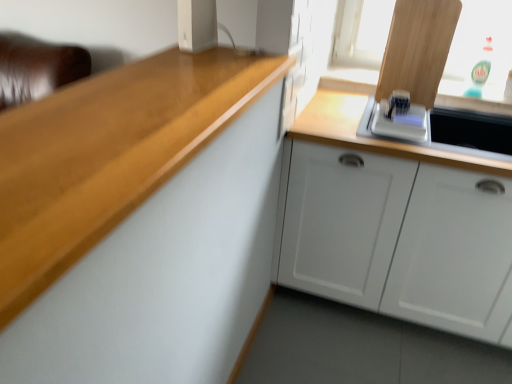
Question: Is white plastic speaker at upper center, positioned as the 2th appliance in back-to-front order, surrounded by white plastic toaster at upper right, arranged as the first appliance when viewed from the back?

Choices:
 (A) no
 (B) yes

Answer: (A)

Question: Is white plastic toaster at upper right, the 1th appliance when ordered from right to left, bigger than white plastic speaker at upper center, which is the 1th appliance from left to right?

Choices:
 (A) yes
 (B) no

Answer: (A)

Question: Is white plastic toaster at upper right, arranged as the first appliance when viewed from the back, to the right of white plastic speaker at upper center, which is the 1th appliance from left to right, from the viewer's perspective?

Choices:
 (A) yes
 (B) no

Answer: (A)

Question: Are white plastic toaster at upper right, arranged as the first appliance when viewed from the back, and white plastic speaker at upper center, positioned as the 2th appliance in back-to-front order, far apart?

Choices:
 (A) no
 (B) yes

Answer: (A)

Question: From a real-world perspective, is white plastic toaster at upper right, arranged as the first appliance when viewed from the back, located beneath white plastic speaker at upper center, which is the 1th appliance from left to right?

Choices:
 (A) no
 (B) yes

Answer: (B)

Question: From the image's perspective, is white plastic toaster at upper right, placed as the second appliance when sorted from front to back, located beneath white plastic speaker at upper center, which is the 1th appliance from left to right?

Choices:
 (A) yes
 (B) no

Answer: (A)

Question: Is white plastic speaker at upper center, positioned as the 2th appliance in back-to-front order, oriented away from white glossy microwave at upper right?

Choices:
 (A) yes
 (B) no

Answer: (B)

Question: Does white plastic speaker at upper center, which is the 1th appliance from left to right, appear on the right side of white glossy microwave at upper right?

Choices:
 (A) no
 (B) yes

Answer: (A)

Question: From a real-world perspective, is white plastic speaker at upper center, which is the 1th appliance from left to right, positioned under white glossy microwave at upper right based on gravity?

Choices:
 (A) no
 (B) yes

Answer: (A)

Question: Is white plastic speaker at upper center, the second appliance viewed from the right, closer to camera compared to white glossy microwave at upper right?

Choices:
 (A) yes
 (B) no

Answer: (A)

Question: Considering the relative sizes of white plastic speaker at upper center, the first appliance viewed from the front, and white glossy microwave at upper right in the image provided, is white plastic speaker at upper center, the first appliance viewed from the front, thinner than white glossy microwave at upper right?

Choices:
 (A) no
 (B) yes

Answer: (B)

Question: Is white plastic speaker at upper center, the first appliance viewed from the front, taller than white glossy microwave at upper right?

Choices:
 (A) no
 (B) yes

Answer: (B)

Question: Considering the relative sizes of white glossy microwave at upper right and white plastic toaster at upper right, the 1th appliance when ordered from right to left, in the image provided, is white glossy microwave at upper right thinner than white plastic toaster at upper right, the 1th appliance when ordered from right to left,?

Choices:
 (A) no
 (B) yes

Answer: (A)